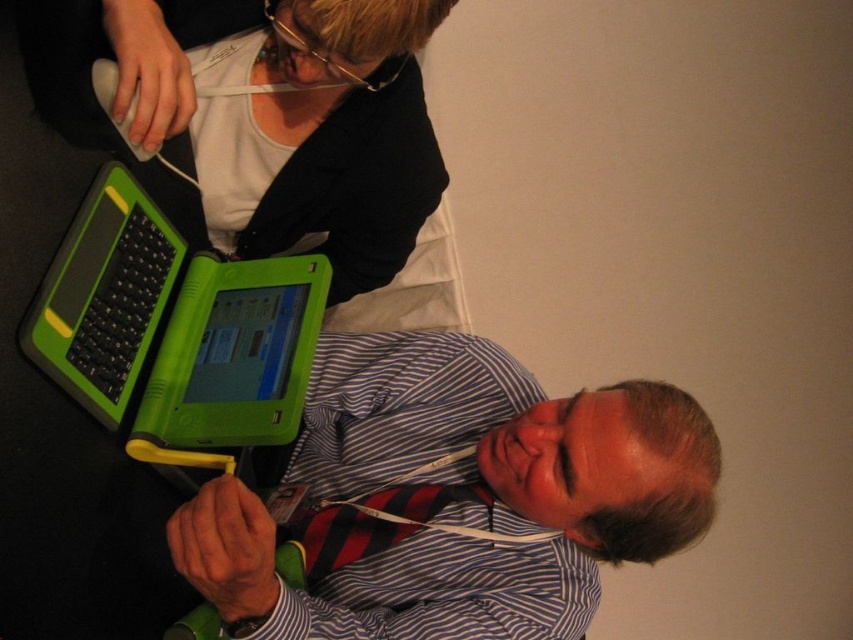
Question: Which object is the closest to the green plastic keyboard at lower left?

Choices:
 (A) red striped tie at lower center
 (B) matte green laptop at lower center
 (C) green plastic laptop at lower left

Answer: (C)

Question: Can you confirm if green plastic laptop at lower left is bigger than green plastic keyboard at lower left?

Choices:
 (A) yes
 (B) no

Answer: (A)

Question: Can you confirm if green plastic laptop at lower left is positioned to the left of green plastic keyboard at lower left?

Choices:
 (A) yes
 (B) no

Answer: (B)

Question: Which point is closer to the camera?

Choices:
 (A) matte green laptop at lower center
 (B) red striped tie at lower center
 (C) green plastic keyboard at lower left

Answer: (C)

Question: Does matte green laptop at lower center come in front of green plastic laptop at lower left?

Choices:
 (A) yes
 (B) no

Answer: (B)

Question: Which of the following is the closest to the observer?

Choices:
 (A) (82, 266)
 (B) (398, 500)

Answer: (A)